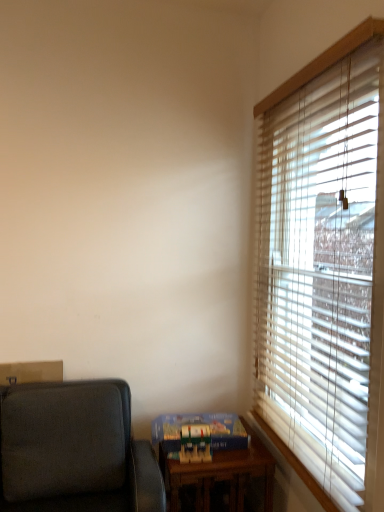
Question: Is hardcover book at lower right, the 1th paperback book viewed from the front, at the back of blue cardboard game set at lower center, the second paperback book viewed from the front?

Choices:
 (A) no
 (B) yes

Answer: (A)

Question: Can you confirm if blue cardboard game set at lower center, marked as the first paperback book in a back-to-front arrangement, is taller than hardcover book at lower right, the 1th paperback book viewed from the front?

Choices:
 (A) no
 (B) yes

Answer: (A)

Question: Is blue cardboard game set at lower center, marked as the first paperback book in a back-to-front arrangement, wider than hardcover book at lower right, placed as the 2th paperback book when sorted from back to front?

Choices:
 (A) no
 (B) yes

Answer: (B)

Question: Does blue cardboard game set at lower center, the second paperback book viewed from the front, appear on the left side of hardcover book at lower right, placed as the 2th paperback book when sorted from back to front?

Choices:
 (A) no
 (B) yes

Answer: (A)

Question: Is blue cardboard game set at lower center, marked as the first paperback book in a back-to-front arrangement, at the right side of hardcover book at lower right, the 1th paperback book viewed from the front?

Choices:
 (A) no
 (B) yes

Answer: (B)

Question: Which is correct: wooden blinds at right is inside blue cardboard game set at lower center, marked as the first paperback book in a back-to-front arrangement, or outside of it?

Choices:
 (A) inside
 (B) outside

Answer: (B)

Question: From the image's perspective, is wooden blinds at right located above or below blue cardboard game set at lower center, marked as the first paperback book in a back-to-front arrangement?

Choices:
 (A) below
 (B) above

Answer: (B)

Question: Is wooden blinds at right taller or shorter than blue cardboard game set at lower center, the second paperback book viewed from the front?

Choices:
 (A) tall
 (B) short

Answer: (A)

Question: Relative to blue cardboard game set at lower center, the second paperback book viewed from the front, is wooden blinds at right in front or behind?

Choices:
 (A) front
 (B) behind

Answer: (A)

Question: From the image's perspective, is hardcover book at lower right, the 1th paperback book viewed from the front, positioned above or below dark gray fabric studio couch at lower left?

Choices:
 (A) below
 (B) above

Answer: (A)

Question: Is point (208, 458) closer or farther from the camera than point (57, 434)?

Choices:
 (A) farther
 (B) closer

Answer: (A)

Question: Is hardcover book at lower right, placed as the 2th paperback book when sorted from back to front, bigger or smaller than dark gray fabric studio couch at lower left?

Choices:
 (A) big
 (B) small

Answer: (B)

Question: Would you say hardcover book at lower right, placed as the 2th paperback book when sorted from back to front, is inside or outside dark gray fabric studio couch at lower left?

Choices:
 (A) inside
 (B) outside

Answer: (B)

Question: Considering the positions of point (180, 415) and point (142, 466), is point (180, 415) closer or farther from the camera than point (142, 466)?

Choices:
 (A) farther
 (B) closer

Answer: (A)

Question: From a real-world perspective, is blue cardboard game set at lower center, marked as the first paperback book in a back-to-front arrangement, physically located above or below dark gray fabric studio couch at lower left?

Choices:
 (A) below
 (B) above

Answer: (A)